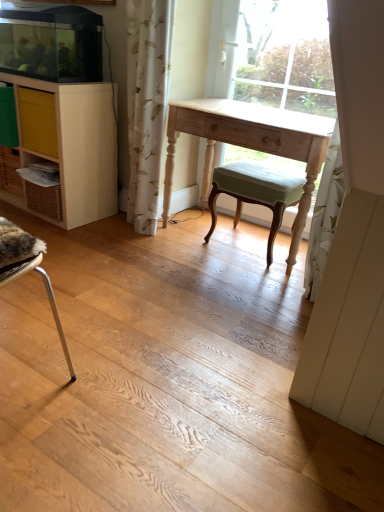
The height and width of the screenshot is (512, 384). What do you see at coordinates (284, 56) in the screenshot?
I see `light wood desk at center` at bounding box center [284, 56].

What do you see at coordinates (255, 194) in the screenshot? This screenshot has width=384, height=512. I see `light green fabric stool at center` at bounding box center [255, 194].

You are a GUI agent. You are given a task and a screenshot of the screen. Output one action in this format:
    pyautogui.click(x=<x>, y=<y>)
    Task: Click on the light wood desk at center
    Image resolution: width=384 pixels, height=512 pixels.
    Given the screenshot: What is the action you would take?
    pyautogui.click(x=250, y=143)

This screenshot has width=384, height=512. What do you see at coordinates (147, 104) in the screenshot?
I see `white floral fabric curtain at center` at bounding box center [147, 104].

Find the location of a particular element. The width and height of the screenshot is (384, 512). light wood cabinet at left is located at coordinates (63, 151).

Does point (42, 126) appear closer or farther from the camera than point (154, 212)?

Clearly, point (42, 126) is closer to the camera than point (154, 212).

In the image, is yellow matte drawer at left positioned in front of or behind white floral fabric curtain at center?

Clearly, yellow matte drawer at left is behind white floral fabric curtain at center.

Consider the image. Considering the sizes of objects yellow matte drawer at left and white floral fabric curtain at center in the image provided, who is shorter, yellow matte drawer at left or white floral fabric curtain at center?

yellow matte drawer at left.

From the image's perspective, is yellow matte drawer at left above or below white floral fabric curtain at center?

yellow matte drawer at left is above white floral fabric curtain at center.

Is white floral fabric curtain at center positioned far away from light wood cabinet at left?

No, white floral fabric curtain at center is not far away from light wood cabinet at left.

Is white floral fabric curtain at center positioned in front of light wood cabinet at left?

Yes, the depth of white floral fabric curtain at center is less than that of light wood cabinet at left.

In terms of size, does white floral fabric curtain at center appear bigger or smaller than light wood cabinet at left?

white floral fabric curtain at center is smaller than light wood cabinet at left.

From a real-world perspective, relative to light wood cabinet at left, is white floral fabric curtain at center vertically above or below?

In terms of real-world spatial position, white floral fabric curtain at center is above light wood cabinet at left.

Considering the positions of objects light wood cabinet at left and light wood desk at center in the image provided, who is more to the right, light wood cabinet at left or light wood desk at center?

light wood desk at center is more to the right.

Consider the image. Is light wood desk at center at the back of light wood cabinet at left?

No, light wood cabinet at left is not facing away from light wood desk at center.

Can you tell me how much light wood cabinet at left and light wood desk at center differ in facing direction?

3.05 degrees separate the facing orientations of light wood cabinet at left and light wood desk at center.

I want to click on bay window located on the right of light wood cabinet at left, so [x=284, y=56].

Is light wood desk at center taller or shorter than light wood cabinet at left?

Considering their sizes, light wood desk at center has more height than light wood cabinet at left.

From a real-world perspective, is light wood desk at center under light wood cabinet at left?

No.

In the scene shown: Considering the positions of objects light wood desk at center and light wood cabinet at left in the image provided, who is more to the right, light wood desk at center or light wood cabinet at left?

light wood desk at center.

Between light wood cabinet at left and light wood desk at center, which one has less height?

light wood desk at center is shorter.

Is light wood cabinet at left not inside light wood desk at center?

light wood cabinet at left is positioned outside light wood desk at center.

The width and height of the screenshot is (384, 512). I want to click on cabinetry that is on the left side of light wood desk at center, so click(x=63, y=151).

Is light wood cabinet at left to the left of light wood desk at center from the viewer's perspective?

Yes, light wood cabinet at left is to the left of light wood desk at center.

Is white floral fabric curtain at center bigger or smaller than light wood desk at center?

In the image, white floral fabric curtain at center appears to be smaller than light wood desk at center.

In the scene shown: Is white floral fabric curtain at center to the right of light wood desk at center from the viewer's perspective?

No, white floral fabric curtain at center is not to the right of light wood desk at center.

How different are the orientations of white floral fabric curtain at center and light wood desk at center in degrees?

The angular difference between white floral fabric curtain at center and light wood desk at center is 1.22 degrees.

From the picture: Considering the relative positions of white floral fabric curtain at center and light wood desk at center in the image provided, is white floral fabric curtain at center in front of light wood desk at center?

No, white floral fabric curtain at center is further to the viewer.

Is light wood desk at center facing away from yellow matte drawer at left?

light wood desk at center does not have its back to yellow matte drawer at left.

Is light wood desk at center smaller than yellow matte drawer at left?

Actually, light wood desk at center might be larger than yellow matte drawer at left.

Does light wood desk at center have a lesser height compared to yellow matte drawer at left?

No.

You are a GUI agent. You are given a task and a screenshot of the screen. Output one action in this format:
    pyautogui.click(x=<x>, y=<y>)
    Task: Click on the drawer that appears above the white floral fabric curtain at center (from the image's perspective)
    The width and height of the screenshot is (384, 512).
    Given the screenshot: What is the action you would take?
    pyautogui.click(x=37, y=121)

This screenshot has width=384, height=512. I want to click on curtain in front of the light wood cabinet at left, so [x=147, y=104].

Considering their positions, is light wood desk at center positioned further to light green fabric stool at center than light wood desk at center?

The object further to light green fabric stool at center is light wood desk at center.

Based on their spatial positions, is light wood desk at center or light green fabric stool at center closer to light wood cabinet at left?

light green fabric stool at center.

From the image, which object appears to be farther from light wood desk at center, light green fabric stool at center or white floral fabric curtain at center?

white floral fabric curtain at center is positioned further to the anchor light wood desk at center.

Considering their positions, is light wood desk at center positioned further to light green fabric stool at center than white floral fabric curtain at center?

Based on the image, white floral fabric curtain at center appears to be further to light green fabric stool at center.

Considering their positions, is yellow matte drawer at left positioned closer to light green fabric stool at center than light wood desk at center?

The object closer to light green fabric stool at center is light wood desk at center.

From the picture: From the image, which object appears to be nearer to light wood desk at center, white floral fabric curtain at center or light green fabric stool at center?

light green fabric stool at center.

When comparing their distances from light wood cabinet at left, does light wood desk at center or yellow matte drawer at left seem further?

light wood desk at center is positioned further to the anchor light wood cabinet at left.

Which object lies further to the anchor point light wood desk at center, white floral fabric curtain at center or light wood desk at center?

light wood desk at center lies further to light wood desk at center than the other object.

The width and height of the screenshot is (384, 512). I want to click on curtain between light wood cabinet at left and light green fabric stool at center, so click(147, 104).

Locate an element on the screen. The width and height of the screenshot is (384, 512). stool between white floral fabric curtain at center and light wood desk at center in the horizontal direction is located at coordinates (255, 194).

Identify the location of stool situated between yellow matte drawer at left and light wood desk at center from left to right. (255, 194).

This screenshot has width=384, height=512. I want to click on curtain between light wood cabinet at left and light wood desk at center, so click(147, 104).